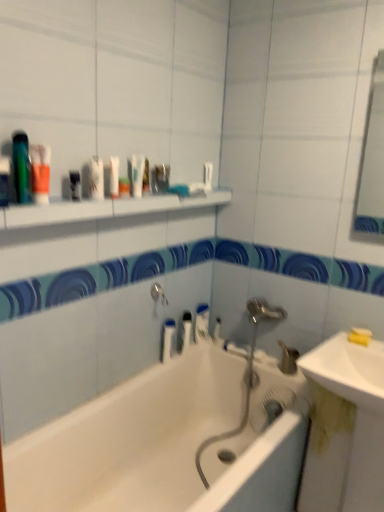
Find the location of a particular element. This screenshot has width=384, height=512. white plastic bottle at upper center, the sixth mouthwash when ordered from bottom to top is located at coordinates (114, 176).

Measure the distance between point [90,191] and camera.

Point [90,191] is 1.50 meters away from camera.

What do you see at coordinates (217, 329) in the screenshot?
I see `white glossy soap at center, the second toiletry from the left` at bounding box center [217, 329].

The height and width of the screenshot is (512, 384). What do you see at coordinates (186, 330) in the screenshot? I see `clear plastic bottle at center, which appears as the 1th mouthwash when viewed from the back` at bounding box center [186, 330].

You are a GUI agent. You are given a task and a screenshot of the screen. Output one action in this format:
    pyautogui.click(x=<x>, y=<y>)
    Task: Click on the white plastic bottle at upper center, the sixth mouthwash when ordered from bottom to top
    The width and height of the screenshot is (384, 512).
    Given the screenshot: What is the action you would take?
    pyautogui.click(x=114, y=176)

Relative to matte plastic container at upper center, the first toiletry viewed from the top, is white glossy soap at center, which appears as the 2th toiletry when viewed from the top, in front or behind?

In the image, white glossy soap at center, which appears as the 2th toiletry when viewed from the top, appears behind matte plastic container at upper center, the first toiletry viewed from the top.

Considering the sizes of objects white glossy soap at center, the second toiletry from the left, and matte plastic container at upper center, marked as the second toiletry in a back-to-front arrangement, in the image provided, who is taller, white glossy soap at center, the second toiletry from the left, or matte plastic container at upper center, marked as the second toiletry in a back-to-front arrangement,?

Standing taller between the two is white glossy soap at center, the second toiletry from the left.

Which object is wider, white glossy soap at center, the second toiletry in the front-to-back sequence, or matte plastic container at upper center, the first toiletry viewed from the top?

Wider between the two is matte plastic container at upper center, the first toiletry viewed from the top.

What's the angular difference between white glossy toothpaste at upper center, which ranks as the 2th toothpaste in bottom-to-top order, and white glossy bathtub at center's facing directions?

0.94 degrees separate the facing orientations of white glossy toothpaste at upper center, which ranks as the 2th toothpaste in bottom-to-top order, and white glossy bathtub at center.

From a real-world perspective, is white glossy toothpaste at upper center, which is the 1th toothpaste in front-to-back order, below white glossy bathtub at center?

No, from a real-world perspective, white glossy toothpaste at upper center, which is the 1th toothpaste in front-to-back order, is not under white glossy bathtub at center.

From the picture: Would you say white glossy toothpaste at upper center, which is the 1th toothpaste in front-to-back order, is to the left or to the right of white glossy bathtub at center in the picture?

Clearly, white glossy toothpaste at upper center, which is the 1th toothpaste in front-to-back order, is on the right of white glossy bathtub at center in the image.

Is white glossy toothpaste at upper center, the first toothpaste from the top, far away from white glossy bathtub at center?

white glossy toothpaste at upper center, the first toothpaste from the top, is far away from white glossy bathtub at center.

Considering the relative sizes of white glossy shelf at upper center and white glossy toothpaste at center, arranged as the first toothpaste when viewed from the back, in the image provided, is white glossy shelf at upper center shorter than white glossy toothpaste at center, arranged as the first toothpaste when viewed from the back,?

Correct, white glossy shelf at upper center is not as tall as white glossy toothpaste at center, arranged as the first toothpaste when viewed from the back.

Based on the photo, which object is further away from the camera, white glossy shelf at upper center or white glossy toothpaste at center, arranged as the first toothpaste when viewed from the back?

white glossy toothpaste at center, arranged as the first toothpaste when viewed from the back, is behind.

Does white glossy shelf at upper center have a larger size compared to white glossy toothpaste at center, which is the second toothpaste from front to back?

Indeed, white glossy shelf at upper center has a larger size compared to white glossy toothpaste at center, which is the second toothpaste from front to back.

Is white glossy shelf at upper center oriented away from white glossy toothpaste at center, acting as the second toothpaste starting from the top?

white glossy shelf at upper center is not turned away from white glossy toothpaste at center, acting as the second toothpaste starting from the top.

From the image's perspective, is translucent orange bottle at upper left, placed as the 4th mouthwash when sorted from bottom to top, above clear plastic bottle at center, positioned as the first mouthwash in right-to-left order?

Yes, from the image's perspective, translucent orange bottle at upper left, placed as the 4th mouthwash when sorted from bottom to top, is over clear plastic bottle at center, positioned as the first mouthwash in right-to-left order.

From a real-world perspective, is translucent orange bottle at upper left, which appears as the first mouthwash when viewed from the left, positioned above or below clear plastic bottle at center, positioned as the first mouthwash in right-to-left order?

From a real-world perspective, translucent orange bottle at upper left, which appears as the first mouthwash when viewed from the left, is physically above clear plastic bottle at center, positioned as the first mouthwash in right-to-left order.

Which of these two, translucent orange bottle at upper left, the 7th mouthwash in the back-to-front sequence, or clear plastic bottle at center, positioned as the first mouthwash in right-to-left order, is smaller?

translucent orange bottle at upper left, the 7th mouthwash in the back-to-front sequence.

Considering the relative positions of translucent orange bottle at upper left, arranged as the 1th mouthwash when viewed from the front, and clear plastic bottle at center, the 7th mouthwash viewed from the left, in the image provided, is translucent orange bottle at upper left, arranged as the 1th mouthwash when viewed from the front, in front of clear plastic bottle at center, the 7th mouthwash viewed from the left,?

Yes, translucent orange bottle at upper left, arranged as the 1th mouthwash when viewed from the front, is closer to the viewer.

Is point (204, 168) behind point (369, 335)?

Yes, it is.

Is white glossy toothpaste at upper center, positioned as the 2th toothpaste in back-to-front order, not close to yellow matte soap at right, which is the 2th soap from bottom to top?

No, white glossy toothpaste at upper center, positioned as the 2th toothpaste in back-to-front order, is not far from yellow matte soap at right, which is the 2th soap from bottom to top.

Is white glossy toothpaste at upper center, the first toothpaste from the top, bigger or smaller than yellow matte soap at right, the first soap when ordered from top to bottom?

Considering their sizes, white glossy toothpaste at upper center, the first toothpaste from the top, takes up more space than yellow matte soap at right, the first soap when ordered from top to bottom.

Are white glossy shelf at upper center and yellow sponge at upper right, arranged as the first soap when ordered from the bottom, making contact?

No, white glossy shelf at upper center is not touching yellow sponge at upper right, arranged as the first soap when ordered from the bottom.

The image size is (384, 512). What are the coordinates of `shelve on the left of the yellow sponge at upper right, arranged as the first soap when ordered from the bottom` in the screenshot? It's located at (104, 209).

From the image's perspective, is white glossy shelf at upper center over yellow sponge at upper right, marked as the second soap in a top-to-bottom arrangement?

Yes, from the image's perspective, white glossy shelf at upper center is above yellow sponge at upper right, marked as the second soap in a top-to-bottom arrangement.

Is white glossy shelf at upper center smaller than yellow sponge at upper right, marked as the second soap in a top-to-bottom arrangement?

Actually, white glossy shelf at upper center might be larger than yellow sponge at upper right, marked as the second soap in a top-to-bottom arrangement.

Identify the location of mouthwash that is the 4th one when counting forward from the translucent plastic mouthwash at upper center, the third mouthwash positioned from the back. The width and height of the screenshot is (384, 512). (40, 172).

Is translucent orange bottle at upper left, the 7th mouthwash in the back-to-front sequence, to the left of translucent plastic mouthwash at upper center, arranged as the third mouthwash when viewed from the right, from the viewer's perspective?

Yes.

Is translucent orange bottle at upper left, arranged as the 1th mouthwash when viewed from the front, oriented away from translucent plastic mouthwash at upper center, arranged as the third mouthwash when viewed from the right?

No, translucent plastic mouthwash at upper center, arranged as the third mouthwash when viewed from the right, is not at the back of translucent orange bottle at upper left, arranged as the 1th mouthwash when viewed from the front.

Identify the location of toiletry located above the white glossy soap at center, the first toiletry when ordered from back to front (from the image's perspective). This screenshot has width=384, height=512. (160, 178).

The height and width of the screenshot is (512, 384). Find the location of `bathtub below the white glossy toothpaste at upper center, which is the 1th toothpaste in front-to-back order (from a real-world perspective)`. bathtub below the white glossy toothpaste at upper center, which is the 1th toothpaste in front-to-back order (from a real-world perspective) is located at coordinates (168, 444).

When comparing their distances from clear plastic bottle at center, the 7th mouthwash viewed from the left, does white glossy soap at center, acting as the first toiletry starting from the right, or translucent orange bottle at upper left, placed as the 4th mouthwash when sorted from bottom to top, seem closer?

white glossy soap at center, acting as the first toiletry starting from the right.

Which object lies nearer to the anchor point yellow sponge at upper right, arranged as the first soap when ordered from the bottom, white glossy soap at center, the second toiletry in the front-to-back sequence, or translucent orange bottle at upper left, arranged as the 1th mouthwash when viewed from the front?

white glossy soap at center, the second toiletry in the front-to-back sequence, is positioned closer to the anchor yellow sponge at upper right, arranged as the first soap when ordered from the bottom.

From the image, which object appears to be farther from white plastic mouthwash at upper center, placed as the third mouthwash when sorted from top to bottom, white glossy sink at lower right, the 1th sink in the bottom-to-top sequence, or white glossy sink at lower right, which is the second sink in bottom-to-top order?

white glossy sink at lower right, the 1th sink in the bottom-to-top sequence, is further to white plastic mouthwash at upper center, placed as the third mouthwash when sorted from top to bottom.

Considering their positions, is white glossy soap at center, the second toiletry in the front-to-back sequence, positioned closer to white glossy toothpaste at upper center, positioned as the 2th toothpaste in back-to-front order, than yellow sponge at upper right, marked as the second soap in a top-to-bottom arrangement?

The object closer to white glossy toothpaste at upper center, positioned as the 2th toothpaste in back-to-front order, is white glossy soap at center, the second toiletry in the front-to-back sequence.

When comparing their distances from silver metallic tap at upper center, does white glossy shelf at upper center or yellow sponge at upper right, marked as the second soap in a top-to-bottom arrangement, seem closer?

white glossy shelf at upper center is closer to silver metallic tap at upper center.

From the image, which object appears to be nearer to yellow matte soap at right, the first soap when ordered from top to bottom, translucent plastic mouthwash at upper center, the fifth mouthwash viewed from the front, or matte plastic container at upper center, the 2th toiletry from the bottom?

Among the two, matte plastic container at upper center, the 2th toiletry from the bottom, is located nearer to yellow matte soap at right, the first soap when ordered from top to bottom.

Looking at the image, which one is located further to white glossy sink at lower right, which is the 2th sink from top to bottom, white glossy bathtub at center or white plastic mouthwash at upper center, the 3th mouthwash from the left?

white plastic mouthwash at upper center, the 3th mouthwash from the left, lies further to white glossy sink at lower right, which is the 2th sink from top to bottom, than the other object.

Estimate the real-world distances between objects in this image. Which object is further from yellow matte soap at right, which is the 2th soap from bottom to top, translucent plastic mouthwash at upper center, which appears as the first mouthwash when viewed from the top, or matte plastic mouthwash at upper left, the 2th mouthwash positioned from the front?

The object further to yellow matte soap at right, which is the 2th soap from bottom to top, is matte plastic mouthwash at upper left, the 2th mouthwash positioned from the front.

Find the location of `tap that lies between matte plastic container at upper center, which is counted as the first toiletry, starting from the left, and clear plastic bottle at center, which appears as the 1th mouthwash when viewed from the back, from top to bottom`. tap that lies between matte plastic container at upper center, which is counted as the first toiletry, starting from the left, and clear plastic bottle at center, which appears as the 1th mouthwash when viewed from the back, from top to bottom is located at coordinates (158, 294).

Locate an element on the screen. tap between matte plastic mouthwash at upper left, which is the 6th mouthwash in right-to-left order, and clear plastic bottle at center, the sixth mouthwash viewed from the top, from front to back is located at coordinates (158, 294).

The height and width of the screenshot is (512, 384). What are the coordinates of `mouthwash between white plastic bottle at center, placed as the 1th mouthwash when sorted from bottom to top, and white glossy sink at lower right, which is the 2th sink from top to bottom` in the screenshot? It's located at (186, 330).

Find the location of a particular element. This screenshot has width=384, height=512. toothpaste between matte plastic container at upper center, the 1th toiletry viewed from the front, and white glossy sink at lower right, which is the second sink in bottom-to-top order, in the vertical direction is located at coordinates (202, 323).